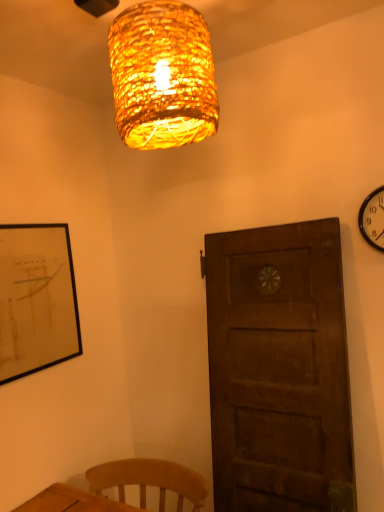
Describe the element at coordinates (162, 76) in the screenshot. This screenshot has height=512, width=384. I see `woven bamboo lampshade at upper center` at that location.

Where is `woven bamboo lampshade at upper center`? The height and width of the screenshot is (512, 384). woven bamboo lampshade at upper center is located at coordinates (162, 76).

Describe the element at coordinates (373, 219) in the screenshot. I see `black metal wall clock at upper right` at that location.

This screenshot has height=512, width=384. Find the location of `black metal wall clock at upper right`. black metal wall clock at upper right is located at coordinates (373, 219).

Measure the distance between black metal wall clock at upper right and camera.

The distance of black metal wall clock at upper right from camera is 5.15 feet.

Locate an element on the screen. woven bamboo lampshade at upper center is located at coordinates (162, 76).

Does woven bamboo lampshade at upper center appear on the left side of black metal wall clock at upper right?

Yes.

Which object is further away from the camera, woven bamboo lampshade at upper center or black metal wall clock at upper right?

black metal wall clock at upper right is further from the camera.

Is point (154, 36) farther from camera compared to point (375, 213)?

No, (154, 36) is closer to viewer.

From the image's perspective, relative to black metal wall clock at upper right, is woven bamboo lampshade at upper center above or below?

Clearly, from the image's perspective, woven bamboo lampshade at upper center is above black metal wall clock at upper right.

From a real-world perspective, which is physically below, woven bamboo lampshade at upper center or black metal wall clock at upper right?

From a 3D spatial view, black metal wall clock at upper right is below.

Which object is wider, woven bamboo lampshade at upper center or black metal wall clock at upper right?

woven bamboo lampshade at upper center.

Who is taller, woven bamboo lampshade at upper center or black metal wall clock at upper right?

With more height is woven bamboo lampshade at upper center.

Which of these two, woven bamboo lampshade at upper center or black metal wall clock at upper right, is bigger?

Bigger between the two is woven bamboo lampshade at upper center.

Is woven bamboo lampshade at upper center not inside black metal wall clock at upper right?

Yes.

Is woven bamboo lampshade at upper center beside black metal wall clock at upper right?

No, woven bamboo lampshade at upper center is not making contact with black metal wall clock at upper right.

Is woven bamboo lampshade at upper center facing towards black metal wall clock at upper right?

No, woven bamboo lampshade at upper center is not oriented towards black metal wall clock at upper right.

The image size is (384, 512). Find the location of `wall clock that is under the woven bamboo lampshade at upper center (from a real-world perspective)`. wall clock that is under the woven bamboo lampshade at upper center (from a real-world perspective) is located at coordinates (373, 219).

Considering the positions of objects black metal wall clock at upper right and woven bamboo lampshade at upper center in the image provided, who is more to the left, black metal wall clock at upper right or woven bamboo lampshade at upper center?

woven bamboo lampshade at upper center is more to the left.

Relative to woven bamboo lampshade at upper center, is black metal wall clock at upper right in front or behind?

In the image, black metal wall clock at upper right appears behind woven bamboo lampshade at upper center.

Which is behind, point (382, 205) or point (131, 17)?

The point (382, 205) is farther from the camera.

From the image's perspective, is black metal wall clock at upper right positioned above or below woven bamboo lampshade at upper center?

black metal wall clock at upper right is below woven bamboo lampshade at upper center.

From a real-world perspective, between black metal wall clock at upper right and woven bamboo lampshade at upper center, who is vertically higher?

From a 3D spatial view, woven bamboo lampshade at upper center is above.

Which object is thinner, black metal wall clock at upper right or woven bamboo lampshade at upper center?

Thinner between the two is black metal wall clock at upper right.

Does black metal wall clock at upper right have a lesser height compared to woven bamboo lampshade at upper center?

Yes, black metal wall clock at upper right is shorter than woven bamboo lampshade at upper center.

Looking at this image, considering the sizes of objects black metal wall clock at upper right and woven bamboo lampshade at upper center in the image provided, who is bigger, black metal wall clock at upper right or woven bamboo lampshade at upper center?

woven bamboo lampshade at upper center.

Can woven bamboo lampshade at upper center be found inside black metal wall clock at upper right?

No, woven bamboo lampshade at upper center is not a part of black metal wall clock at upper right.

Is the surface of black metal wall clock at upper right in direct contact with woven bamboo lampshade at upper center?

black metal wall clock at upper right is not next to woven bamboo lampshade at upper center, and they're not touching.

Is black metal wall clock at upper right facing towards woven bamboo lampshade at upper center?

No.

How different are the orientations of black metal wall clock at upper right and woven bamboo lampshade at upper center in degrees?

0.52 degrees.

How much distance is there between black metal wall clock at upper right and woven bamboo lampshade at upper center?

black metal wall clock at upper right is 34.85 inches from woven bamboo lampshade at upper center.

This screenshot has width=384, height=512. Identify the location of lamp in front of the black metal wall clock at upper right. (162, 76).

The image size is (384, 512). I want to click on wall clock that is under the woven bamboo lampshade at upper center (from a real-world perspective), so click(373, 219).

Find the location of `wall clock that is behind the woven bamboo lampshade at upper center`. wall clock that is behind the woven bamboo lampshade at upper center is located at coordinates (373, 219).